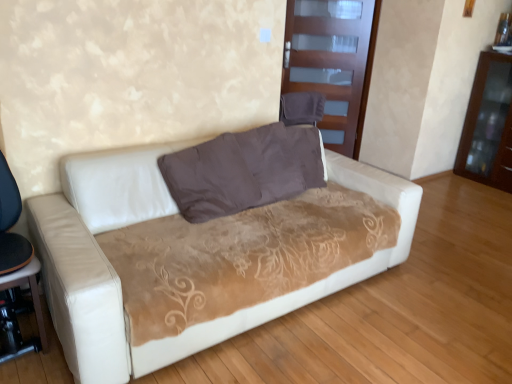
Question: Considering the relative positions of brown suede pillow at center and brown glossy dresser at right in the image provided, is brown suede pillow at center to the left of brown glossy dresser at right from the viewer's perspective?

Choices:
 (A) no
 (B) yes

Answer: (B)

Question: From the image's perspective, is brown suede pillow at center below brown glossy dresser at right?

Choices:
 (A) no
 (B) yes

Answer: (B)

Question: Does brown suede pillow at center have a lesser height compared to brown glossy dresser at right?

Choices:
 (A) yes
 (B) no

Answer: (A)

Question: Is the depth of brown suede pillow at center less than that of brown glossy dresser at right?

Choices:
 (A) no
 (B) yes

Answer: (B)

Question: Is brown suede pillow at center further to the viewer compared to brown glossy dresser at right?

Choices:
 (A) yes
 (B) no

Answer: (B)

Question: From a real-world perspective, is brown suede pillow at center physically above brown glossy dresser at right?

Choices:
 (A) no
 (B) yes

Answer: (B)

Question: Is brown glossy dresser at right positioned with its back to white leather couch at center?

Choices:
 (A) no
 (B) yes

Answer: (A)

Question: Is brown glossy dresser at right with white leather couch at center?

Choices:
 (A) yes
 (B) no

Answer: (B)

Question: Is brown glossy dresser at right oriented towards white leather couch at center?

Choices:
 (A) no
 (B) yes

Answer: (B)

Question: From a real-world perspective, is brown glossy dresser at right physically below white leather couch at center?

Choices:
 (A) yes
 (B) no

Answer: (B)

Question: Is brown glossy dresser at right behind white leather couch at center?

Choices:
 (A) yes
 (B) no

Answer: (A)

Question: Does brown glossy dresser at right come in front of white leather couch at center?

Choices:
 (A) yes
 (B) no

Answer: (B)

Question: Could brown suede pillow at center be considered to be inside transparent glass door at upper center?

Choices:
 (A) yes
 (B) no

Answer: (B)